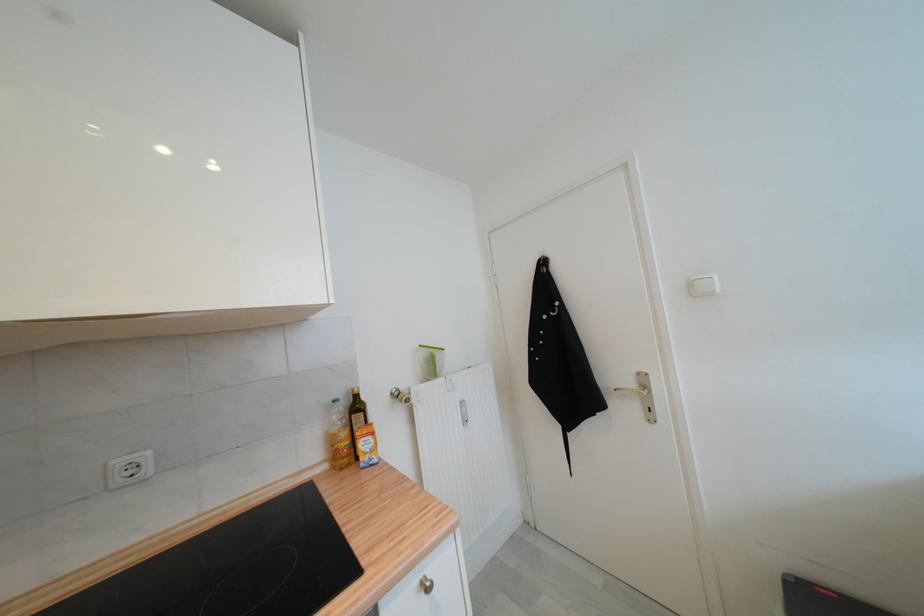
Find where to plugg the white electrical outlet. Please return your answer as a coordinate pair (x, y).

(132, 469)